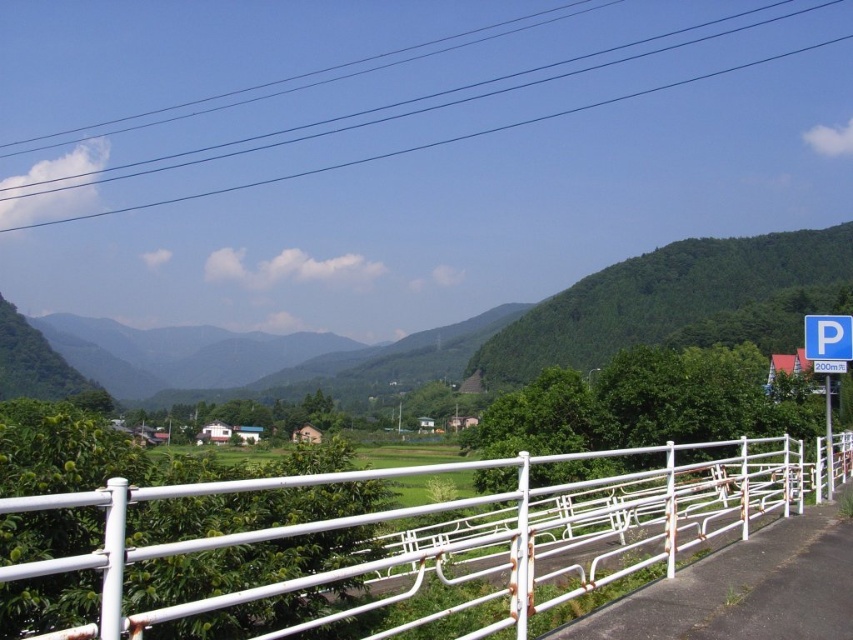
Is white metal fence at center taller than green leafy mountain at center?

No.

Does white metal fence at center have a larger size compared to green leafy mountain at center?

No, white metal fence at center is not bigger than green leafy mountain at center.

You are a GUI agent. You are given a task and a screenshot of the screen. Output one action in this format:
    pyautogui.click(x=<x>, y=<y>)
    Task: Click on the white metal fence at center
    This screenshot has width=853, height=640.
    Given the screenshot: What is the action you would take?
    pyautogui.click(x=457, y=532)

Does white metal fence at center come in front of blue plastic parking sign at right?

Yes, white metal fence at center is closer to the viewer.

Is point (627, 545) positioned after point (830, 392)?

Yes, point (627, 545) is behind point (830, 392).

Where is `white metal fence at center`? The width and height of the screenshot is (853, 640). white metal fence at center is located at coordinates (457, 532).

What do you see at coordinates (601, 317) in the screenshot? The width and height of the screenshot is (853, 640). I see `green leafy mountain at center` at bounding box center [601, 317].

Where is `green leafy mountain at center`? Image resolution: width=853 pixels, height=640 pixels. green leafy mountain at center is located at coordinates (601, 317).

Between point (514, 308) and point (817, 326), which one is positioned behind?

Positioned behind is point (514, 308).

This screenshot has width=853, height=640. Identify the location of green leafy mountain at center. (601, 317).